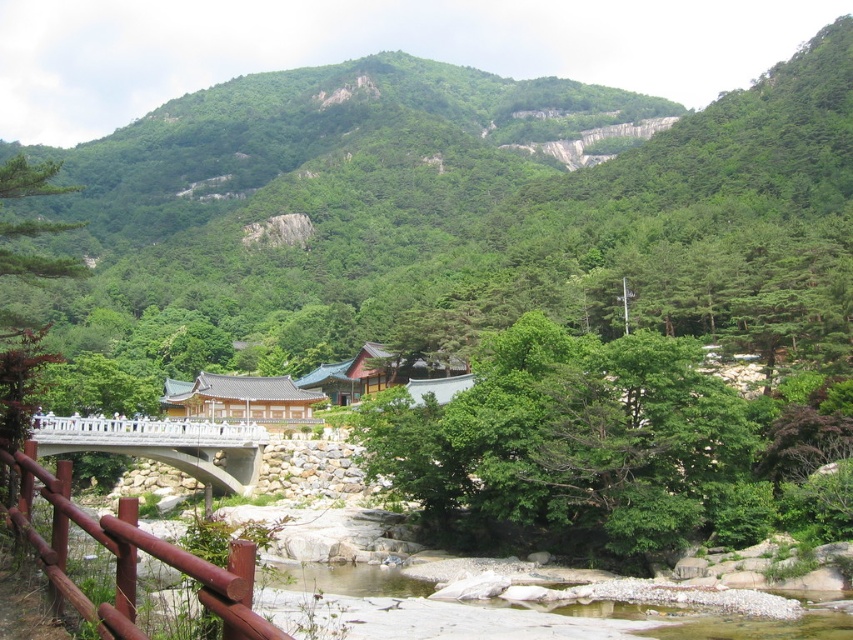
Is brown wooden rail at lower left bigger than white concrete bridge at center?

No.

Who is positioned more to the left, brown wooden rail at lower left or white concrete bridge at center?

Positioned to the left is white concrete bridge at center.

From the picture: Who is more distant from viewer, (x=117, y=579) or (x=68, y=435)?

The point (x=68, y=435) is more distant.

What are the coordinates of `brown wooden rail at lower left` in the screenshot? It's located at (132, 557).